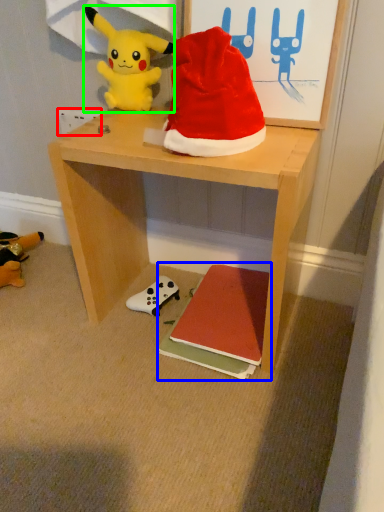
Question: Which object is positioned closest to power outlet (highlighted by a red box)? Select from book (highlighted by a blue box) and toy (highlighted by a green box).

Choices:
 (A) book
 (B) toy

Answer: (B)